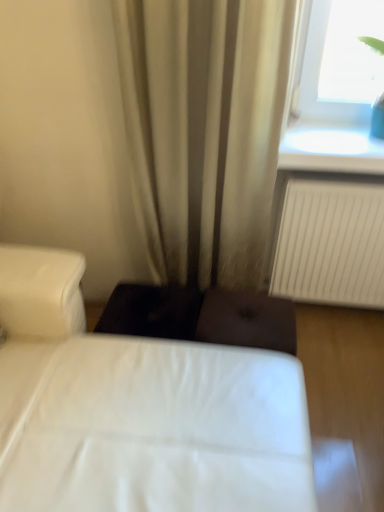
Locate an element on the screen. The image size is (384, 512). white fabric bed at center is located at coordinates (137, 410).

This screenshot has height=512, width=384. Describe the element at coordinates (352, 53) in the screenshot. I see `transparent glass at upper right` at that location.

You are a GUI agent. You are given a task and a screenshot of the screen. Output one action in this format:
    pyautogui.click(x=<x>, y=<y>)
    Task: Click on the white fabric bed at center
    This screenshot has height=512, width=384.
    Given the screenshot: What is the action you would take?
    pyautogui.click(x=137, y=410)

Considering the sizes of objects transparent glass at upper right and white fabric bed at center in the image provided, who is thinner, transparent glass at upper right or white fabric bed at center?

Thinner between the two is transparent glass at upper right.

Choose the correct answer: Is transparent glass at upper right inside white fabric bed at center or outside it?

transparent glass at upper right is outside white fabric bed at center.

Is transparent glass at upper right shorter than white fabric bed at center?

Yes.

Considering the relative sizes of transparent glass at upper right and white fabric bed at center in the image provided, is transparent glass at upper right bigger than white fabric bed at center?

Actually, transparent glass at upper right might be smaller than white fabric bed at center.

Is beige fabric curtain at center with transparent glass at upper right?

No, beige fabric curtain at center is not beside transparent glass at upper right.

Looking at the image, does beige fabric curtain at center seem bigger or smaller compared to transparent glass at upper right?

Considering their sizes, beige fabric curtain at center takes up more space than transparent glass at upper right.

What are the coordinates of `window screen above the beige fabric curtain at center (from the image's perspective)` in the screenshot? It's located at (352, 53).

Does white fabric bed at center have a greater height compared to beige fabric curtain at center?

No.

Between white fabric bed at center and beige fabric curtain at center, which one appears on the left side from the viewer's perspective?

From the viewer's perspective, white fabric bed at center appears more on the left side.

From the image's perspective, relative to beige fabric curtain at center, is white fabric bed at center above or below?

white fabric bed at center is situated lower than beige fabric curtain at center in the image.

Is beige fabric curtain at center at the back of white fabric bed at center?

white fabric bed at center does not have its back to beige fabric curtain at center.

From a real-world perspective, is white fabric bed at center physically below transparent glass at upper right?

Correct, in the physical world, white fabric bed at center is lower than transparent glass at upper right.

What's the angular difference between white fabric bed at center and transparent glass at upper right's facing directions?

The angle between the facing direction of white fabric bed at center and the facing direction of transparent glass at upper right is 90.2 degrees.

Considering the points (261, 432) and (326, 75), which point is behind, point (261, 432) or point (326, 75)?

The point (326, 75) is farther from the camera.

Does beige fabric curtain at center have a greater height compared to white fabric bed at center?

Indeed, beige fabric curtain at center has a greater height compared to white fabric bed at center.

From the image's perspective, is beige fabric curtain at center on top of white fabric bed at center?

Yes, from the image's perspective, beige fabric curtain at center is over white fabric bed at center.

In order to click on bed in front of the beige fabric curtain at center in this screenshot , I will do `click(137, 410)`.

Based on their positions, is transparent glass at upper right located to the left or right of beige fabric curtain at center?

From the image, it's evident that transparent glass at upper right is to the right of beige fabric curtain at center.

Is transparent glass at upper right shorter than beige fabric curtain at center?

Yes.

From the image's perspective, which object appears higher, transparent glass at upper right or beige fabric curtain at center?

transparent glass at upper right.

Where is `bed that is under the transparent glass at upper right (from a real-world perspective)`? This screenshot has height=512, width=384. bed that is under the transparent glass at upper right (from a real-world perspective) is located at coordinates (137, 410).

I want to click on window screen located above the beige fabric curtain at center (from a real-world perspective), so click(x=352, y=53).

Looking at the image, which one is located further to transparent glass at upper right, beige fabric curtain at center or white fabric bed at center?

white fabric bed at center is further to transparent glass at upper right.

Estimate the real-world distances between objects in this image. Which object is further from beige fabric curtain at center, white fabric bed at center or transparent glass at upper right?

white fabric bed at center is positioned further to the anchor beige fabric curtain at center.

Considering their positions, is transparent glass at upper right positioned further to beige fabric curtain at center than white fabric bed at center?

white fabric bed at center is further to beige fabric curtain at center.

Which object lies further to the anchor point transparent glass at upper right, white fabric bed at center or beige fabric curtain at center?

The object further to transparent glass at upper right is white fabric bed at center.

Which object lies further to the anchor point white fabric bed at center, beige fabric curtain at center or transparent glass at upper right?

transparent glass at upper right is further to white fabric bed at center.

Based on their spatial positions, is transparent glass at upper right or beige fabric curtain at center further from white fabric bed at center?

transparent glass at upper right lies further to white fabric bed at center than the other object.

At what (x,y) coordinates should I click in order to perform the action: click on curtain between transparent glass at upper right and white fabric bed at center in the vertical direction. Please return your answer as a coordinate pair (x, y). The image size is (384, 512). Looking at the image, I should click on (204, 130).